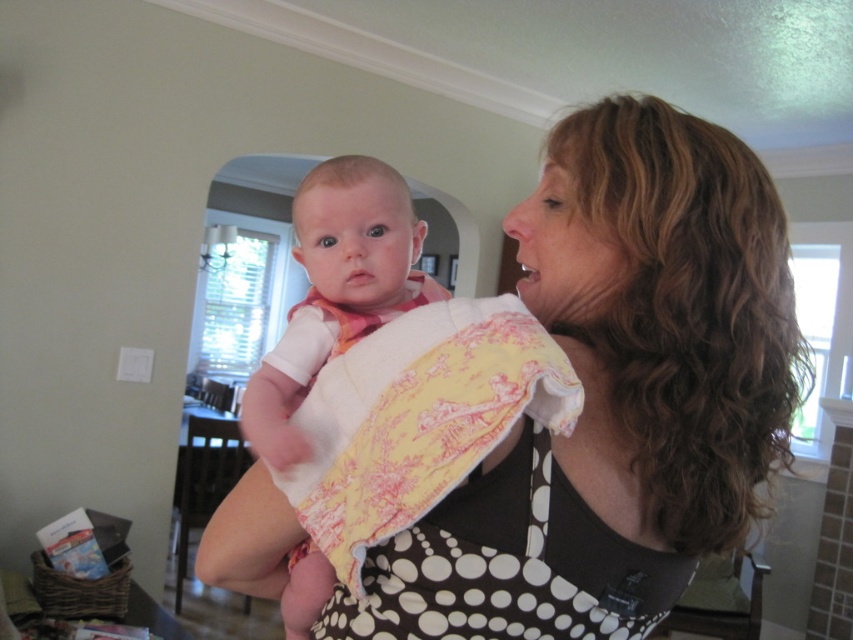
You are a photographer setting up for a family portrait. You notice the yellow printed fabric at center and the soft yellow fabric baby at center in the scene. Which object is closer to the camera?

The soft yellow fabric baby at center is closer to the camera because the yellow printed fabric at center is positioned under it.

You are a tailor trying to determine which fabric is shorter between the polka dot fabric at center and the soft yellow fabric baby at center. Based on the scene, which one is shorter?

The polka dot fabric at center is not as tall as the soft yellow fabric baby at center, so the polka dot fabric at center is shorter.

You are a tailor trying to decide which fabric to use for a new dress. You have two options in the image, the polka dot fabric at center and the yellow printed fabric at center. Which fabric has a larger area available for your project?

The polka dot fabric at center is bigger than the yellow printed fabric at center, so the polka dot fabric at center has a larger area available for your project.